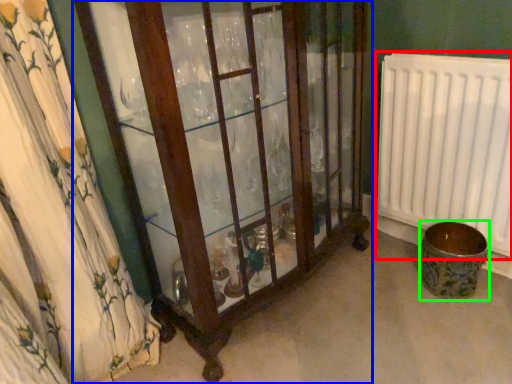
Question: Estimate the real-world distances between objects in this image. Which object is farther from radiator (highlighted by a red box), furniture (highlighted by a blue box) or toilet bowl (highlighted by a green box)?

Choices:
 (A) furniture
 (B) toilet bowl

Answer: (A)